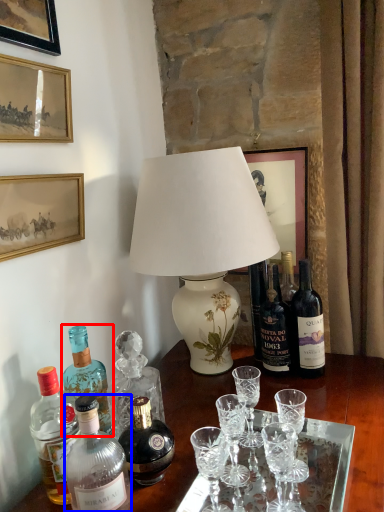
Question: Which point is closer to the camera, bottle (highlighted by a red box) or bottle (highlighted by a blue box)?

Choices:
 (A) bottle
 (B) bottle

Answer: (B)